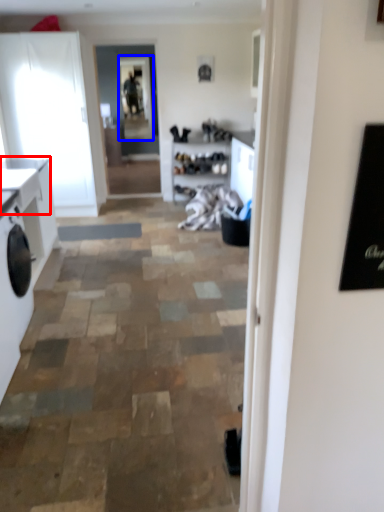
Question: Which object is further to the camera taking this photo, counter top (highlighted by a red box) or window screen (highlighted by a blue box)?

Choices:
 (A) counter top
 (B) window screen

Answer: (B)